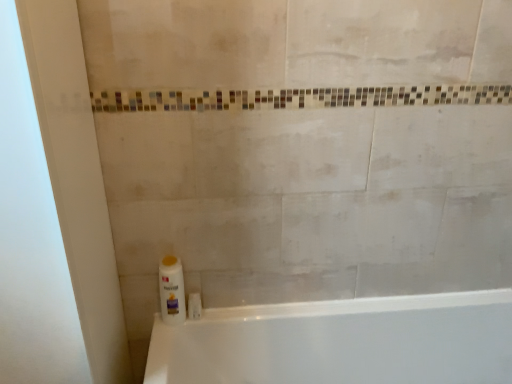
Question: Is white glossy screen door at left closer to the viewer compared to white glossy bottle at lower left?

Choices:
 (A) yes
 (B) no

Answer: (A)

Question: From the image's perspective, does white glossy screen door at left appear higher than white glossy bottle at lower left?

Choices:
 (A) yes
 (B) no

Answer: (A)

Question: From a real-world perspective, is white glossy screen door at left on top of white glossy bottle at lower left?

Choices:
 (A) no
 (B) yes

Answer: (B)

Question: Is white glossy screen door at left not inside white glossy bottle at lower left?

Choices:
 (A) no
 (B) yes

Answer: (B)

Question: Does white glossy screen door at left have a lesser width compared to white glossy bottle at lower left?

Choices:
 (A) yes
 (B) no

Answer: (B)

Question: Can you confirm if white glossy screen door at left is smaller than white glossy bottle at lower left?

Choices:
 (A) no
 (B) yes

Answer: (A)

Question: Is white glossy bottle at lower left closer to camera compared to white glossy bathtub at lower left?

Choices:
 (A) yes
 (B) no

Answer: (B)

Question: Does white glossy bottle at lower left turn towards white glossy bathtub at lower left?

Choices:
 (A) yes
 (B) no

Answer: (A)

Question: Can you confirm if white glossy bottle at lower left is positioned to the right of white glossy bathtub at lower left?

Choices:
 (A) no
 (B) yes

Answer: (A)

Question: Can you confirm if white glossy bottle at lower left is bigger than white glossy bathtub at lower left?

Choices:
 (A) no
 (B) yes

Answer: (A)

Question: Can you confirm if white glossy bottle at lower left is thinner than white glossy bathtub at lower left?

Choices:
 (A) no
 (B) yes

Answer: (B)

Question: Does white glossy bottle at lower left have a greater height compared to white glossy bathtub at lower left?

Choices:
 (A) no
 (B) yes

Answer: (A)

Question: Would you consider white glossy bathtub at lower left to be distant from white glossy screen door at left?

Choices:
 (A) yes
 (B) no

Answer: (B)